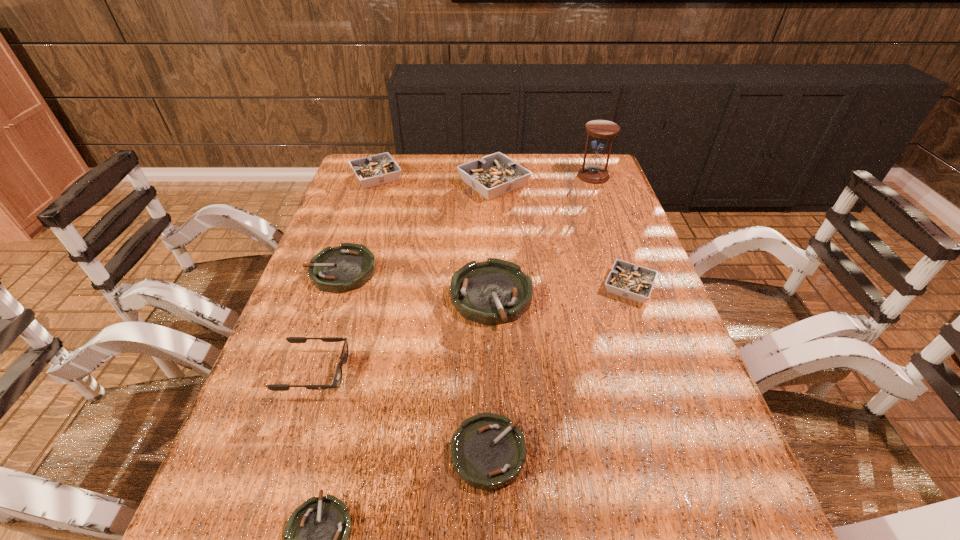
Locate an element on the screen. ashtray identified as the fourth closest to the rightmost gray ashtray is located at coordinates (347, 267).

Select which gray ashtray is the closest to the nearest gray ashtray. Please provide its 2D coordinates. Your answer should be formatted as a tuple, i.e. [(x, y)], where the tuple contains the x and y coordinates of a point satisfying the conditions above.

[(494, 175)]

At what (x,y) coordinates should I click in order to perform the action: click on gray ashtray that stands as the second closest to the rightmost gray ashtray. Please return your answer as a coordinate pair (x, y). Looking at the image, I should click on (378, 169).

Where is `green ashtray that is the second nearest to the second biggest green ashtray`? green ashtray that is the second nearest to the second biggest green ashtray is located at coordinates (488, 451).

Locate which green ashtray ranks fourth in proximity to the smallest gray ashtray. Please provide its 2D coordinates. Your answer should be formatted as a tuple, i.e. [(x, y)], where the tuple contains the x and y coordinates of a point satisfying the conditions above.

[(316, 535)]

I want to click on vacant space that satisfies the following two spatial constraints: 1. on the front side of the third smallest green ashtray; 2. on the left side of the smallest gray ashtray, so click(x=336, y=287).

You are a GUI agent. You are given a task and a screenshot of the screen. Output one action in this format:
    pyautogui.click(x=<x>, y=<y>)
    Task: Click on the free space in the image that satisfies the following two spatial constraints: 1. on the back side of the second biggest gray ashtray; 2. on the right side of the second biggest green ashtray
    
    Given the screenshot: What is the action you would take?
    pyautogui.click(x=373, y=177)